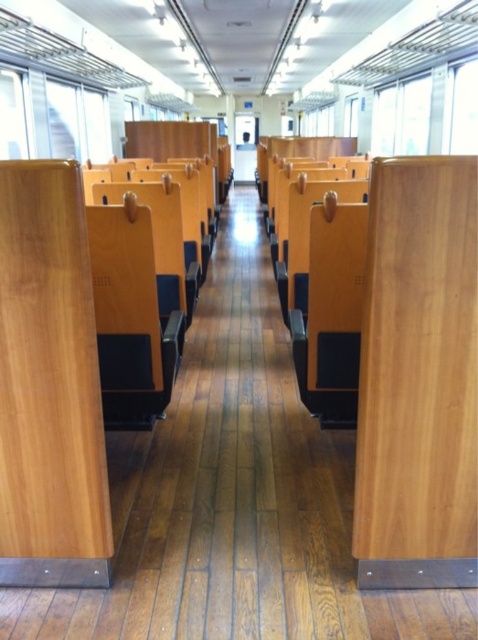
You are a traveler trying to decide where to place your large backpack in a train carriage. You see a wooden chair at center and a wooden seat at center. Which object can accommodate your backpack?

The wooden chair at center is bigger than the wooden seat at center, so the wooden chair at center can accommodate your backpack.

You are a passenger in the train carriage and want to place your backpack on the wooden seat at center. However, you notice the wooden chair at center is already occupied. Can you still place your backpack there?

The wooden seat at center is behind the wooden chair at center, so you can place your backpack on the wooden seat at center since it is not blocked by the occupied wooden chair at center.

You are sitting at a seat in the train carriage and want to reach a luggage compartment located at point (145, 339). There is an obstacle at point (348, 227). Which point is closer to your current position so you can navigate around the obstacle?

Point (348, 227) is closer to your current position since it is in front of point (145, 339), allowing you to navigate around the obstacle first before reaching the luggage compartment.